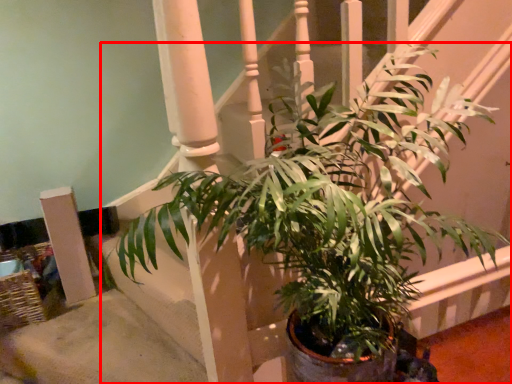
Question: In this image, where is houseplant (annotated by the red box) located relative to pillar?

Choices:
 (A) left
 (B) right

Answer: (B)